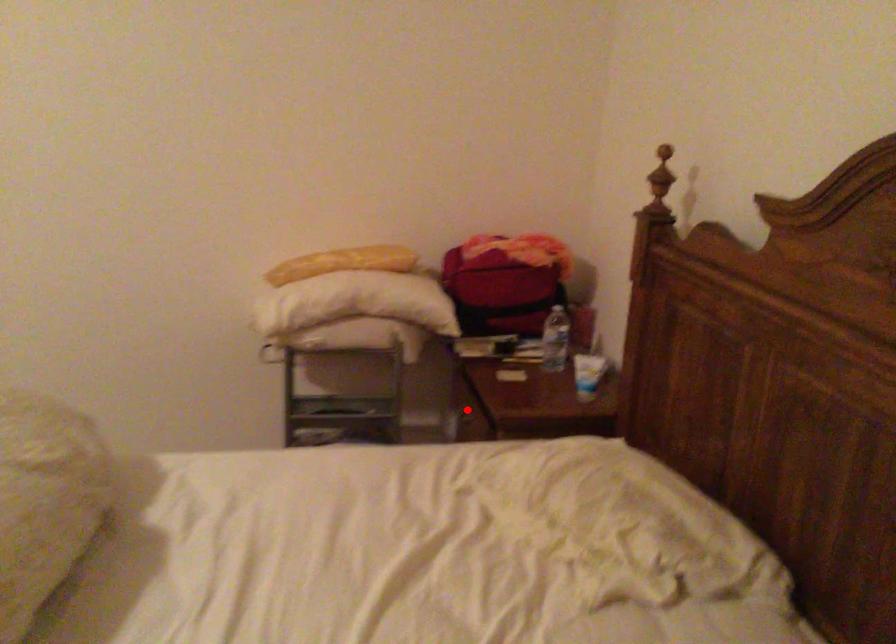
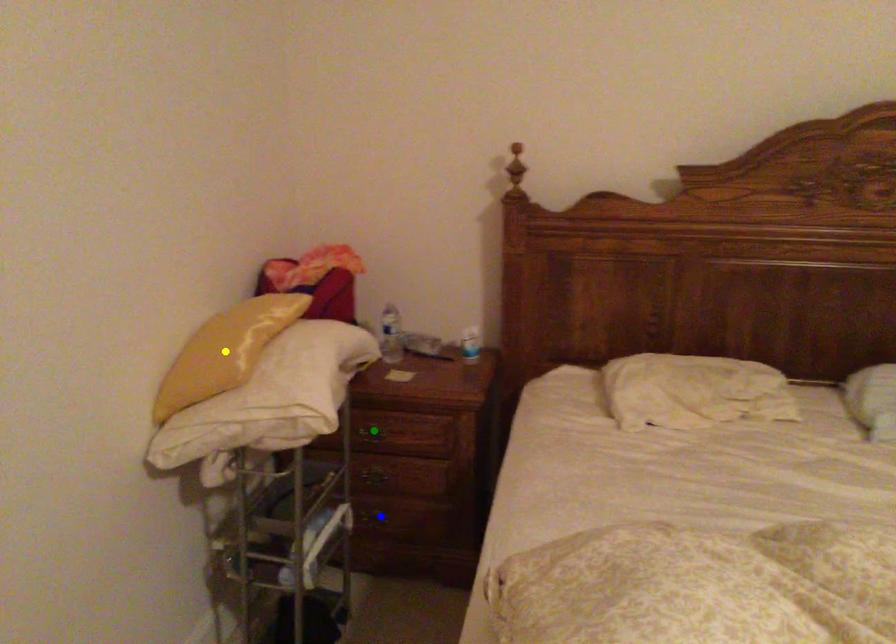
Question: I am providing you with two images of the same scene from different viewpoints. A red point is marked on the first image. You are given multiple points on the second image. Which point in image 2 represents the same 3d spot as the red point in image 1?

Choices:
 (A) blue point
 (B) green point
 (C) yellow point

Answer: (B)